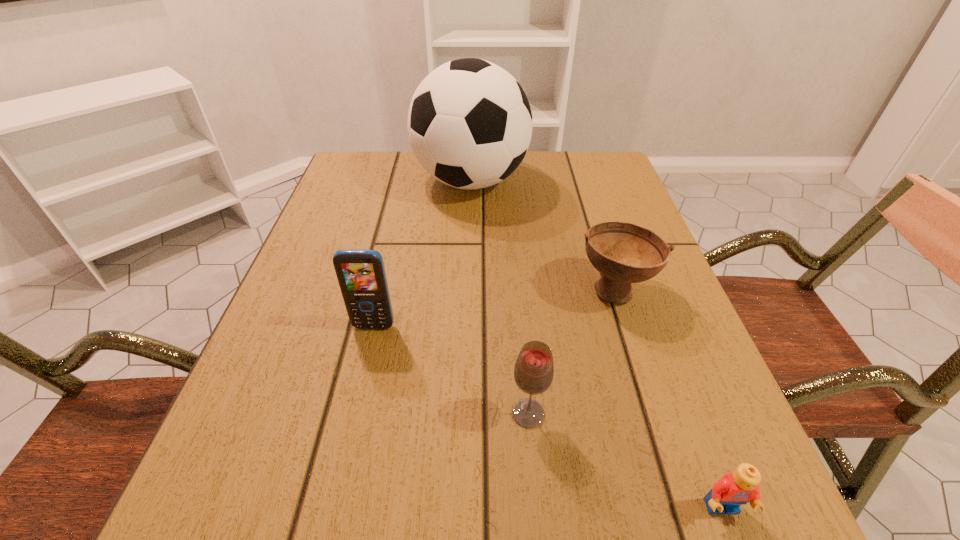
The image size is (960, 540). In the image, there is a desktop. In order to click on vacant space at the right edge in this screenshot , I will do `click(599, 279)`.

Identify the location of free location at the far right corner. (612, 155).

This screenshot has width=960, height=540. I want to click on empty location between the nearest object and the soup bowl, so click(x=668, y=399).

This screenshot has height=540, width=960. I want to click on vacant point located between the shortest object and the fourth nearest object, so (x=668, y=399).

At what (x,y) coordinates should I click in order to perform the action: click on free point between the shortest object and the third farthest object. Please return your answer as a coordinate pair (x, y). Image resolution: width=960 pixels, height=540 pixels. Looking at the image, I should click on [548, 417].

This screenshot has height=540, width=960. What are the coordinates of `free space between the fourth nearest object and the Lego` in the screenshot? It's located at pyautogui.click(x=668, y=399).

I want to click on empty space between the cellular telephone and the Lego, so click(548, 417).

Identify the location of vacant space that is in between the glass drink container and the cellular telephone. Image resolution: width=960 pixels, height=540 pixels. (451, 370).

The height and width of the screenshot is (540, 960). Find the location of `free spot between the soup bowl and the glass drink container`. free spot between the soup bowl and the glass drink container is located at coordinates (571, 352).

Locate an element on the screen. unoccupied position between the fourth farthest object and the second tallest object is located at coordinates (451, 370).